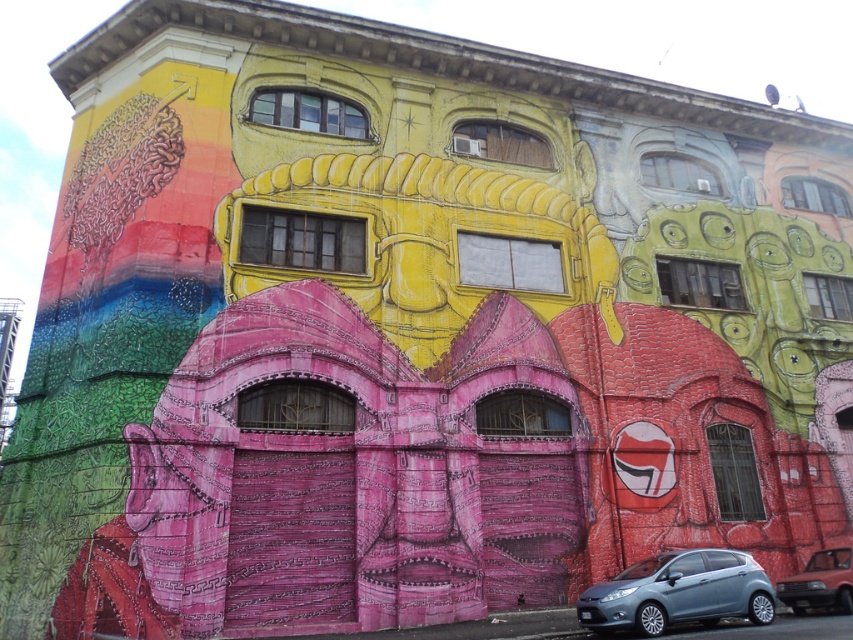
You are driving a car that is 4.2 meters long and want to park between the satin blue hatchback at lower center and the metallic red car at lower right. Can your car fit in the space between them?

The space between the satin blue hatchback at lower center and the metallic red car at lower right is 3.42 meters. Since your car is 4.2 meters long, it cannot fit in the available space.

You are driving a car and see the image. You need to park your car in the parking lot. Which car, the satin blue hatchback at lower center or the metallic red car at lower right, is blocking your path to the parking spot?

The satin blue hatchback at lower center is positioned over metallic red car at lower right, so the metallic red car at lower right is underneath and not blocking the path. The satin blue hatchback at lower center is blocking the path.

From the picture: You are driving a car and want to park it in a parking spot that is exactly 14 meters away from the camera. Can the satin blue hatchback at lower center fit into the parking spot?

The satin blue hatchback at lower center is 14.31 meters from the camera, which is slightly longer than the required 14 meters. Therefore, it may not fit into the parking spot.